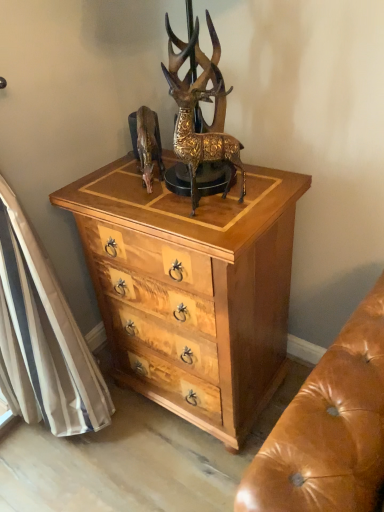
Question: Is light wood/texture chest of drawers at center in front of or behind shiny brown deer at center in the image?

Choices:
 (A) behind
 (B) front

Answer: (B)

Question: Is light wood/texture chest of drawers at center situated inside shiny brown deer at center or outside?

Choices:
 (A) outside
 (B) inside

Answer: (A)

Question: Estimate the real-world distances between objects in this image. Which object is closer to the light wood/texture chest of drawers at center?

Choices:
 (A) gold textured deer at center
 (B) shiny brown deer at center

Answer: (A)

Question: Based on their relative distances, which object is nearer to the gold textured deer at center?

Choices:
 (A) light wood/texture chest of drawers at center
 (B) shiny brown deer at center

Answer: (B)